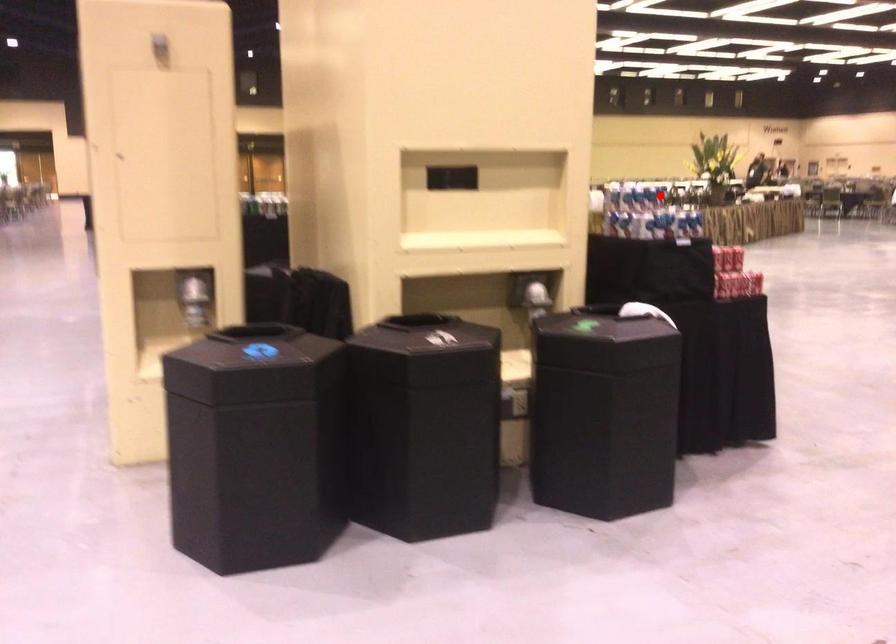
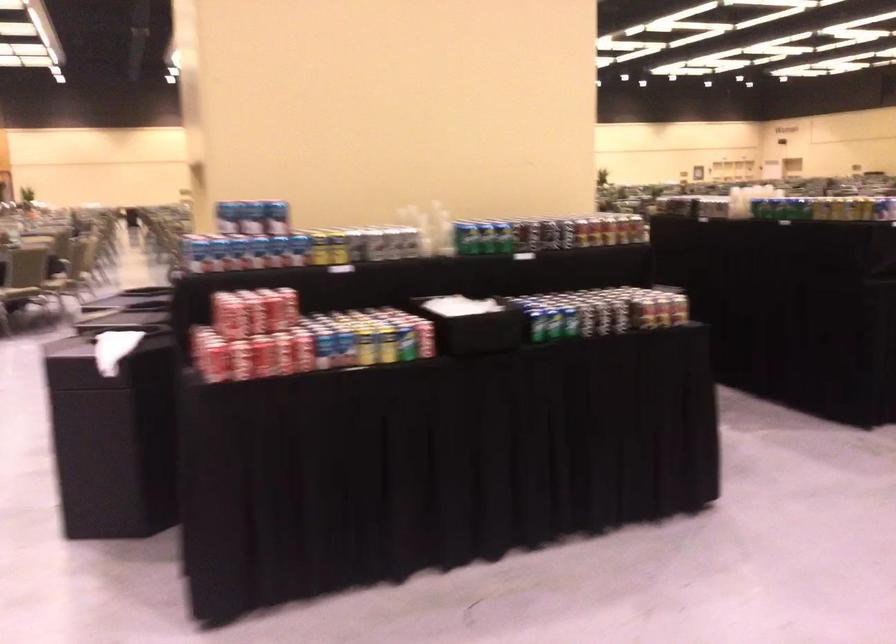
Locate, in the second image, the point that corresponds to the highlighted location in the first image.

(257, 216)